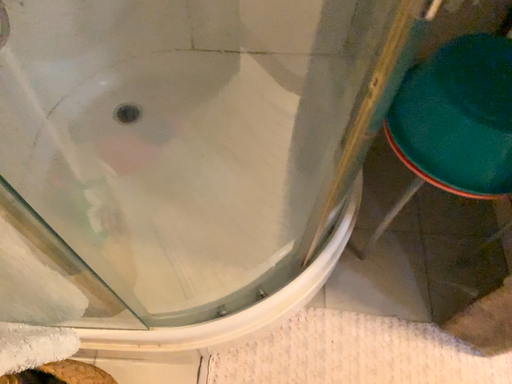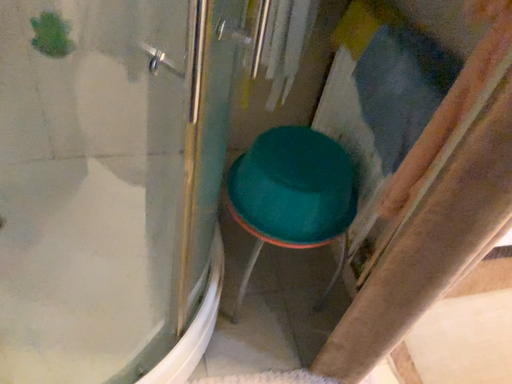
Question: How did the camera likely rotate when shooting the video?

Choices:
 (A) rotated upward
 (B) rotated downward

Answer: (A)